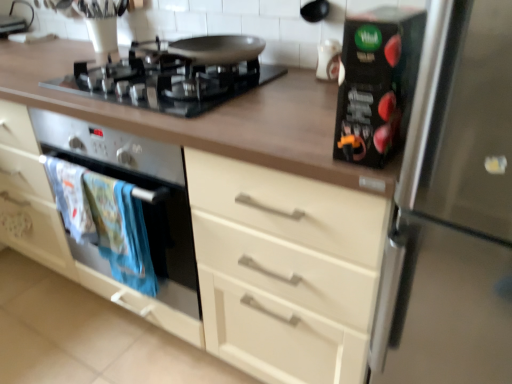
Question: From a real-world perspective, is matte black oven at left located higher than white fabric towels at lower left?

Choices:
 (A) yes
 (B) no

Answer: (A)

Question: Can you confirm if matte black oven at left is bigger than white fabric towels at lower left?

Choices:
 (A) no
 (B) yes

Answer: (B)

Question: Is matte black oven at left located outside white fabric towels at lower left?

Choices:
 (A) yes
 (B) no

Answer: (A)

Question: Can you see matte black oven at left touching white fabric towels at lower left?

Choices:
 (A) no
 (B) yes

Answer: (A)

Question: Does matte black oven at left have a greater width compared to white fabric towels at lower left?

Choices:
 (A) yes
 (B) no

Answer: (A)

Question: From the image's perspective, relative to matte black oven at left, is white fabric towels at lower left above or below?

Choices:
 (A) above
 (B) below

Answer: (B)

Question: In terms of height, does white fabric towels at lower left look taller or shorter compared to matte black oven at left?

Choices:
 (A) tall
 (B) short

Answer: (B)

Question: Would you say white fabric towels at lower left is inside or outside matte black oven at left?

Choices:
 (A) inside
 (B) outside

Answer: (A)

Question: In the image, is white fabric towels at lower left positioned in front of or behind matte black oven at left?

Choices:
 (A) front
 (B) behind

Answer: (B)

Question: Does point (256, 59) appear closer or farther from the camera than point (345, 21)?

Choices:
 (A) closer
 (B) farther

Answer: (B)

Question: In the image, is black glass gas stove at upper center positioned in front of or behind black glossy box at upper right, placed as the 2th appliance when sorted from top to bottom?

Choices:
 (A) behind
 (B) front

Answer: (A)

Question: Would you say black glass gas stove at upper center is to the left or to the right of black glossy box at upper right, placed as the 2th appliance when sorted from top to bottom, in the picture?

Choices:
 (A) left
 (B) right

Answer: (A)

Question: In terms of size, does black glass gas stove at upper center appear bigger or smaller than black glossy box at upper right, arranged as the first appliance when viewed from the front?

Choices:
 (A) small
 (B) big

Answer: (B)

Question: From a real-world perspective, is white glossy vase at upper center, which is the 2th appliance in front-to-back order, above or below stainless steel refrigerator at right?

Choices:
 (A) below
 (B) above

Answer: (B)

Question: Is white glossy vase at upper center, marked as the second appliance in a bottom-to-top arrangement, in front of or behind stainless steel refrigerator at right in the image?

Choices:
 (A) front
 (B) behind

Answer: (B)